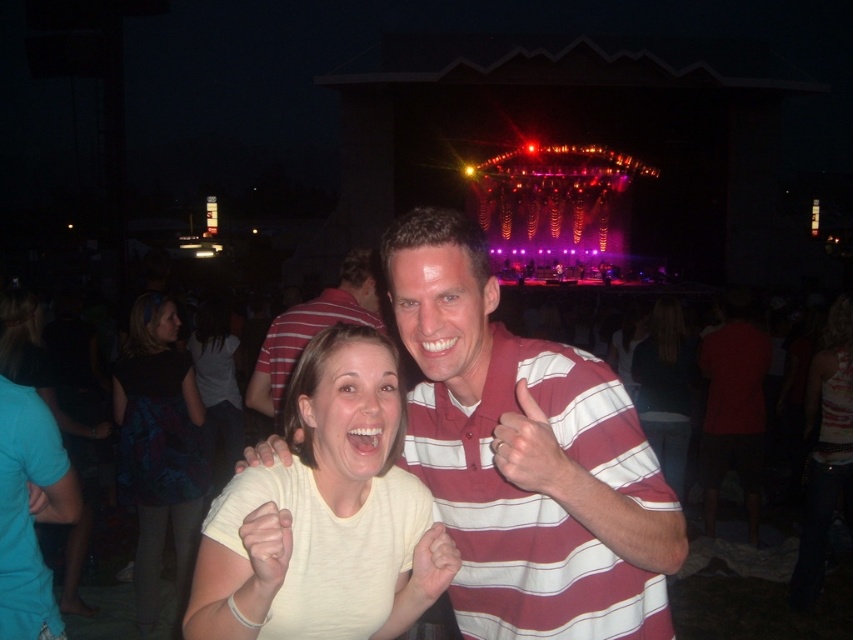
You are at the concert and want to take a photo of both the matte black dress at lower left and the light yellow shirt at center. However, you can only focus on one object at a time. Which one should you focus on first to ensure the other is still in the frame?

The matte black dress at lower left is below the light yellow shirt at center, so you should focus on the light yellow shirt at center first. This way, the matte black dress at lower left will still be in the frame below it.

In the concert scene, you see a matte black dress at lower left and a striped cotton shirt at center. Which one is positioned more to the left side of the image?

The matte black dress at lower left is positioned to the left of the striped cotton shirt at center, so it is more to the left.

You are a photographer positioned at the center of the stage. You want to capture a photo of both the matte black dress at lower left and the striped cotton shirt at center in the same frame. Considering your camera has a maximum focal length of 50 meters, will you be able to include both subjects in the shot?

The matte black dress at lower left is 12.21 meters away from the striped cotton shirt at center. Since the camera can focus up to 50 meters, both subjects are within the 50 meters range, so yes, they can be captured in the same frame.